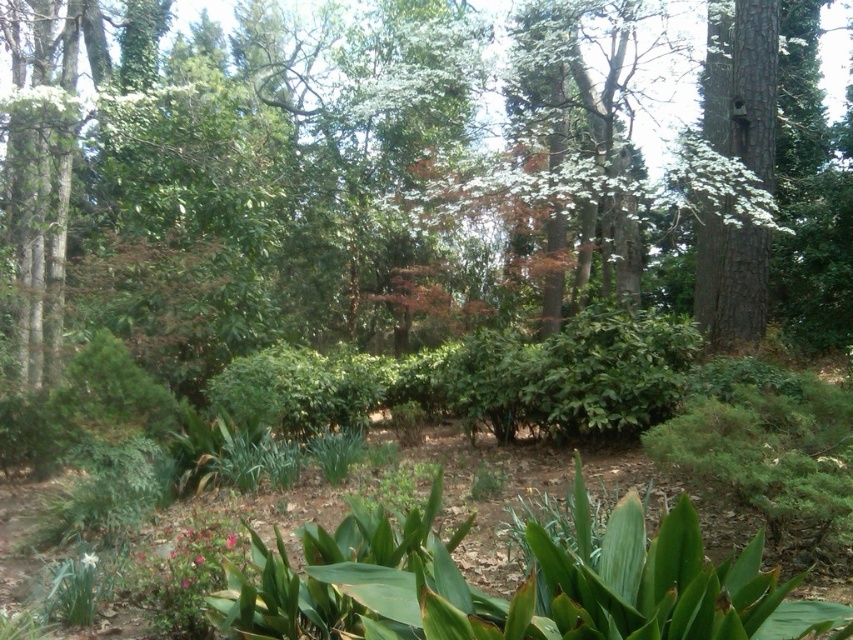
Question: Among these points, which one is nearest to the camera?

Choices:
 (A) (190, 547)
 (B) (82, 557)

Answer: (A)

Question: Is brown rough bark tree at upper right further to the viewer compared to green matte flower at lower left?

Choices:
 (A) yes
 (B) no

Answer: (A)

Question: Which of the following is the closest to the observer?

Choices:
 (A) pink matte flower at lower left
 (B) pink matte flower at lower center

Answer: (A)

Question: Does brown rough bark tree at upper right have a smaller size compared to pink matte flower at lower left?

Choices:
 (A) yes
 (B) no

Answer: (B)

Question: Can you confirm if pink matte flower at lower left is positioned to the left of pink matte flower at lower center?

Choices:
 (A) yes
 (B) no

Answer: (A)

Question: Which point is farther to the camera?

Choices:
 (A) pink matte flower at lower left
 (B) green matte flower at lower left

Answer: (B)